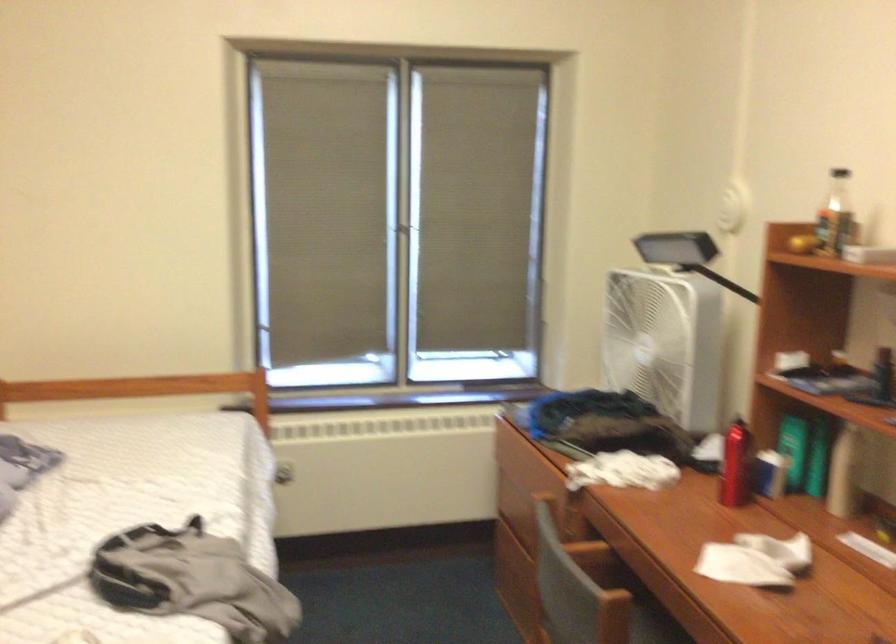
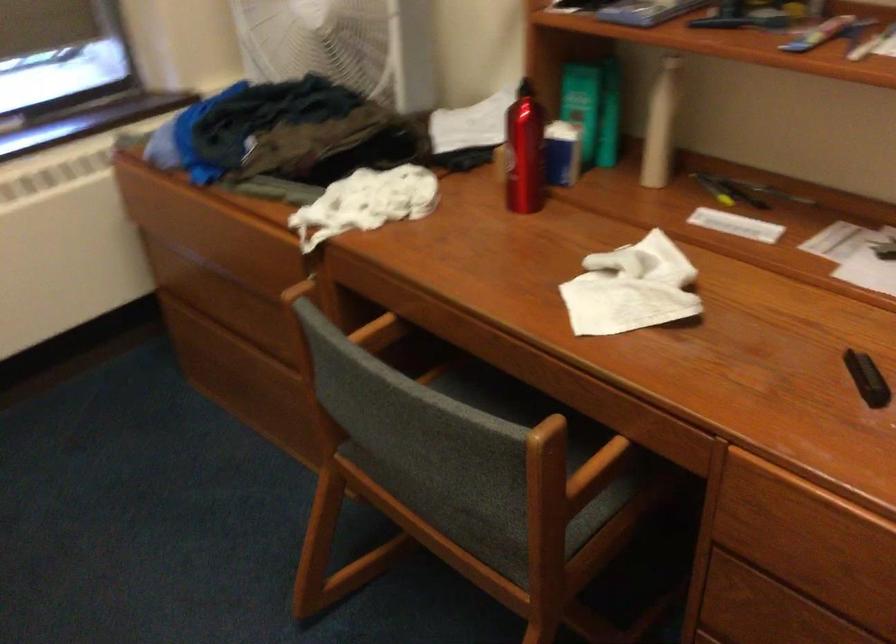
The point at [729,462] is marked in the first image. Where is the corresponding point in the second image?

(524, 152)